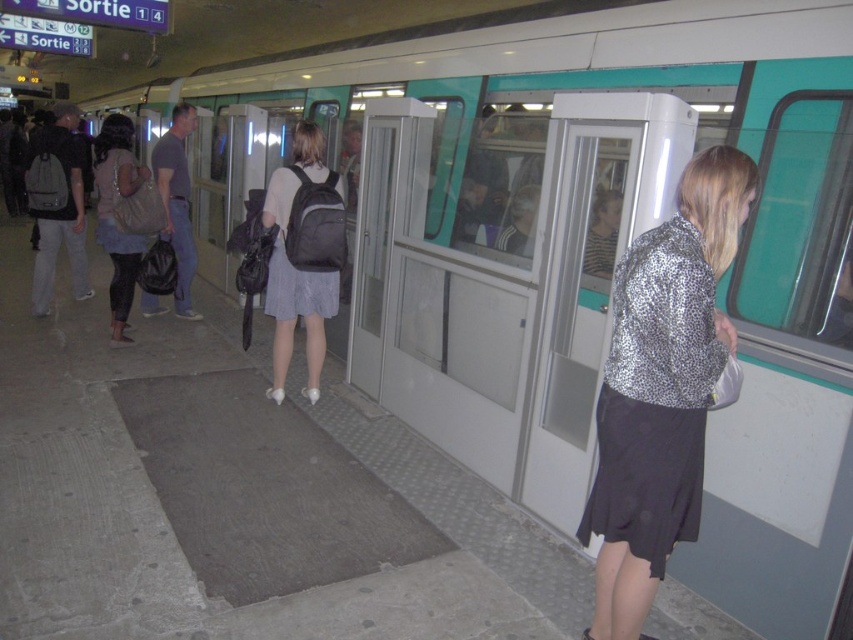
Which is below, matte black backpack at center or matte black backpack at left?

matte black backpack at center

Image resolution: width=853 pixels, height=640 pixels. What do you see at coordinates (303, 256) in the screenshot?
I see `matte black backpack at center` at bounding box center [303, 256].

Who is more forward, (x=286, y=314) or (x=143, y=248)?

Positioned in front is point (x=286, y=314).

You are a GUI agent. You are given a task and a screenshot of the screen. Output one action in this format:
    pyautogui.click(x=<x>, y=<y>)
    Task: Click on the matte black backpack at center
    
    Given the screenshot: What is the action you would take?
    pyautogui.click(x=303, y=256)

Does point (126, 204) come behind point (160, 157)?

No.

Can you confirm if matte black backpack at left is smaller than dark gray backpack at center?

No.

Is point (146, 182) closer to viewer compared to point (151, 160)?

That is True.

The width and height of the screenshot is (853, 640). What are the coordinates of `matte black backpack at left` in the screenshot? It's located at (123, 214).

Does matte black backpack at center have a smaller size compared to dark gray backpack at center?

Yes.

Who is more forward, (325, 257) or (177, 113)?

Point (325, 257) is in front.

Between point (306, 141) and point (186, 205), which one is positioned behind?

The point (186, 205) is behind.

The width and height of the screenshot is (853, 640). In order to click on matte black backpack at center in this screenshot , I will do 303,256.